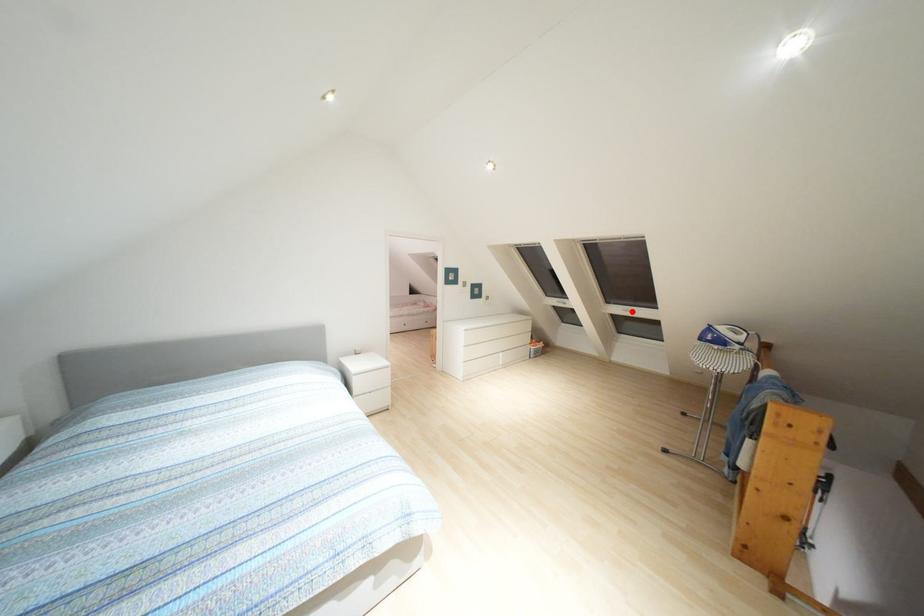
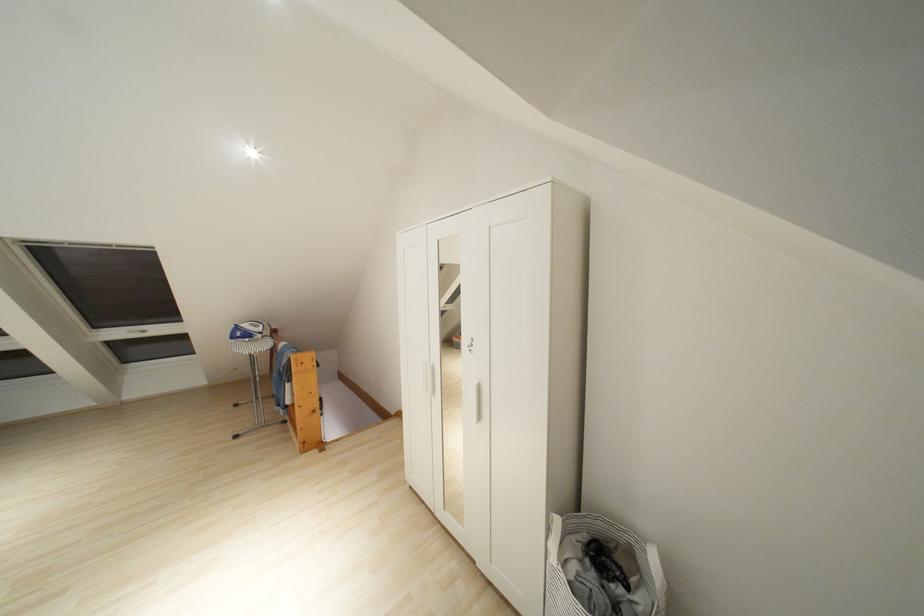
The point at the highlighted location is marked in the first image. Where is the corresponding point in the second image?

(141, 331)